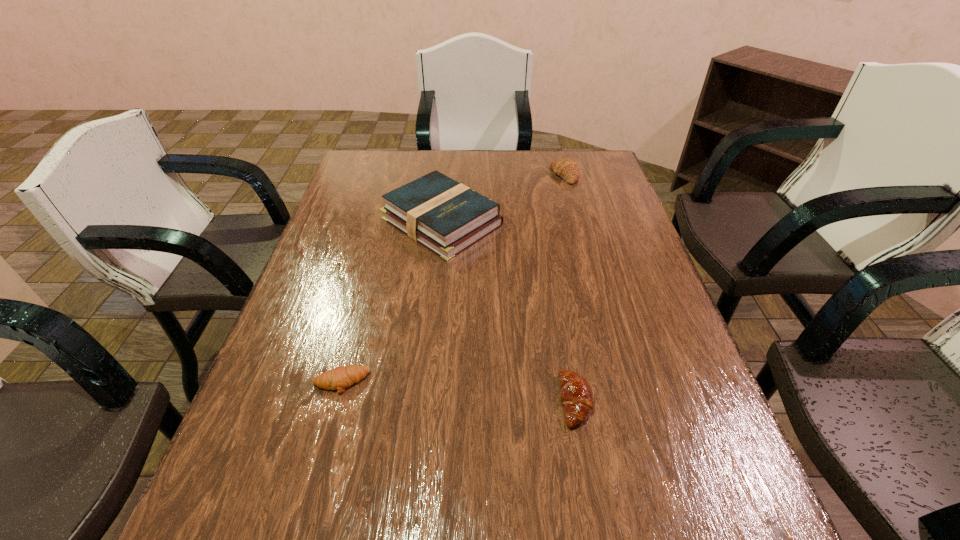
Locate an element on the screen. blank space at the far right corner of the desktop is located at coordinates (610, 180).

At what (x,y) coordinates should I click in order to perform the action: click on free space between the shortest object and the tallest object. Please return your answer as a coordinate pair (x, y). Image resolution: width=960 pixels, height=540 pixels. Looking at the image, I should click on (392, 302).

What are the coordinates of `empty space that is in between the shortest object and the second crescent roll from right to left` in the screenshot? It's located at (458, 392).

What are the coordinates of `free spot between the farthest object and the hardback book` in the screenshot? It's located at (503, 199).

This screenshot has height=540, width=960. In order to click on vacant point located between the second shortest crescent roll and the farthest object in this screenshot , I will do [570, 288].

What are the coordinates of `vacant point located between the tallest object and the tallest crescent roll` in the screenshot? It's located at (503, 199).

The image size is (960, 540). I want to click on unoccupied position between the shortest crescent roll and the rightmost object, so click(453, 279).

What are the coordinates of `blank region between the shortest crescent roll and the tallest object` in the screenshot? It's located at 392,302.

Locate an element on the screen. The width and height of the screenshot is (960, 540). vacant space that is in between the shortest crescent roll and the third nearest object is located at coordinates (392, 302).

Where is `vacant region between the hardback book and the second crescent roll from left to right`? This screenshot has width=960, height=540. vacant region between the hardback book and the second crescent roll from left to right is located at coordinates (509, 311).